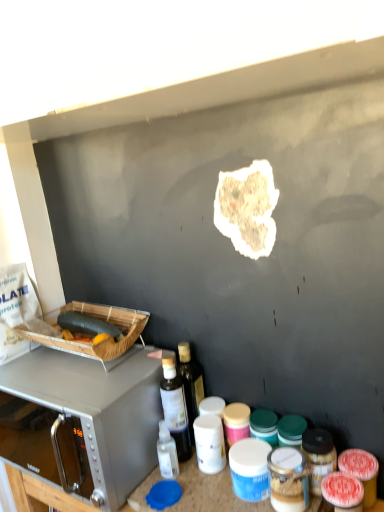
At what (x,y) coordinates should I click in order to perform the action: click on free spot in front of wooden crate at left, which is the first appliance from back to front. Please return your answer as a coordinate pair (x, y). This screenshot has height=512, width=384. Looking at the image, I should click on (75, 382).